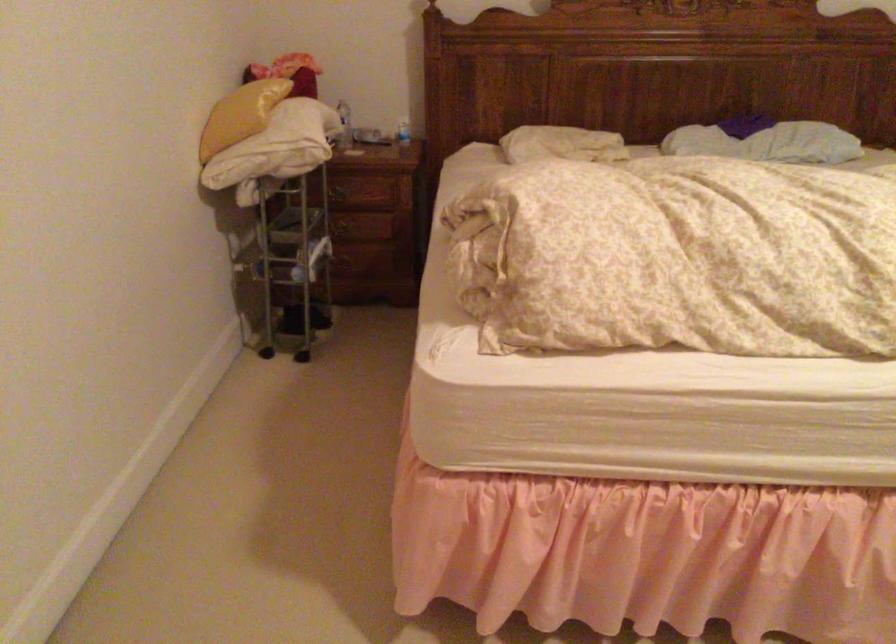
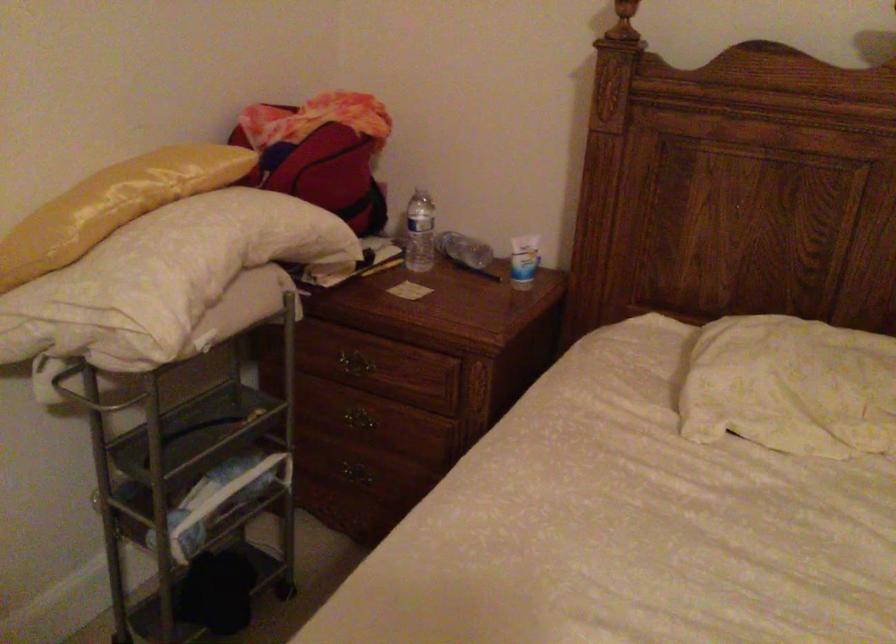
The point at (x=348, y=260) is marked in the first image. Where is the corresponding point in the second image?

(355, 473)